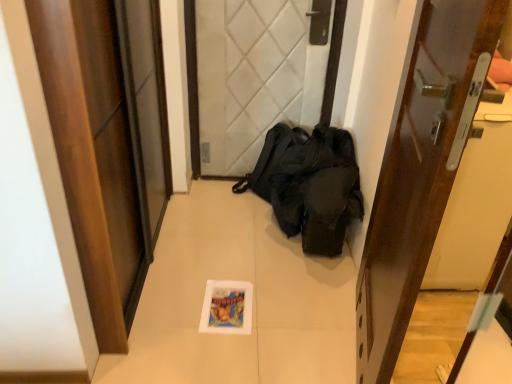
Image resolution: width=512 pixels, height=384 pixels. What are the coordinates of `unoccupied space behind wooden door at left, placed as the first door when sorted from left to right` in the screenshot? It's located at (197, 216).